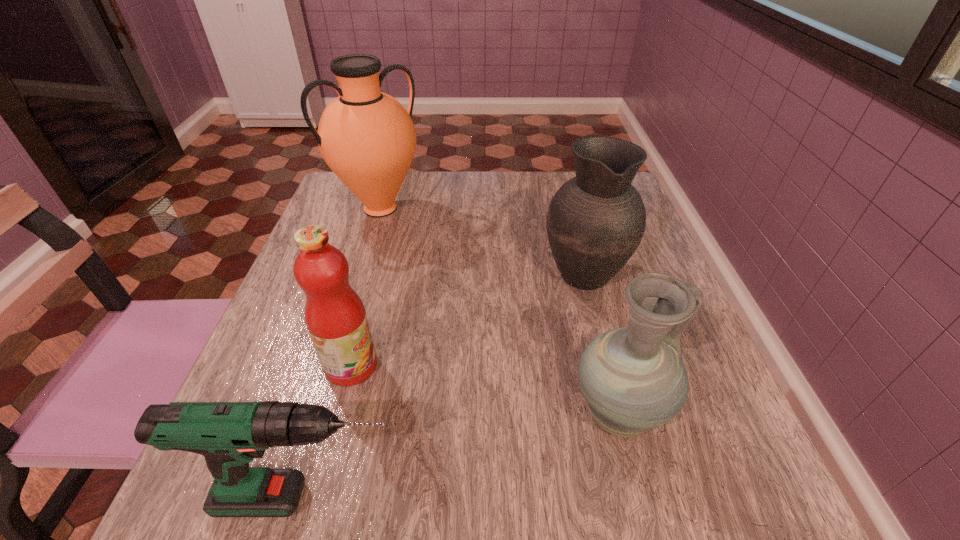
Locate an element on the screen. The width and height of the screenshot is (960, 540). vacant space located 0.190m on the side of the fourth nearest object with the handle is located at coordinates (564, 199).

Where is `vacant position located on the front label of the fruit juice`? This screenshot has height=540, width=960. vacant position located on the front label of the fruit juice is located at coordinates (423, 366).

The width and height of the screenshot is (960, 540). In order to click on vacant space situated on the handle side of the nearest pitcher in this screenshot , I will do `click(697, 415)`.

Locate an element on the screen. This screenshot has width=960, height=540. blank space located 0.280m on the handle side of the shortest object is located at coordinates (611, 498).

I want to click on object situated at the far edge, so click(367, 138).

You are a GUI agent. You are given a task and a screenshot of the screen. Output one action in this format:
    pyautogui.click(x=<x>, y=<y>)
    Task: Click on the object at the near edge
    
    Given the screenshot: What is the action you would take?
    pos(229,435)

The height and width of the screenshot is (540, 960). I want to click on pitcher at the left edge, so click(x=367, y=138).

The width and height of the screenshot is (960, 540). Identify the location of fruit juice located in the left edge section of the desktop. (335, 316).

Where is `drill that is at the left edge`? drill that is at the left edge is located at coordinates (229, 435).

Identify the location of object situated at the far left corner. (367, 138).